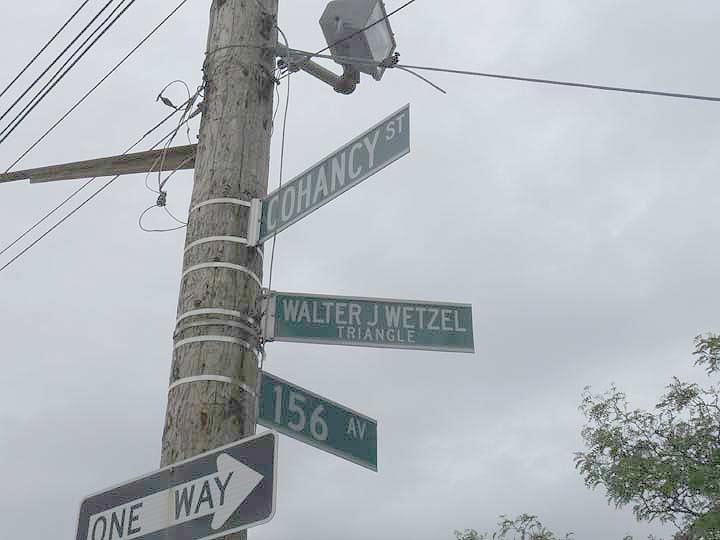
At what (x,y) coordinates should I click in order to perform the action: click on black wires. Please return your answer as a coordinate pair (x, y). This screenshot has height=540, width=720. Looking at the image, I should click on (139, 56), (117, 36), (111, 26), (88, 8), (80, 6), (418, 65), (391, 14).